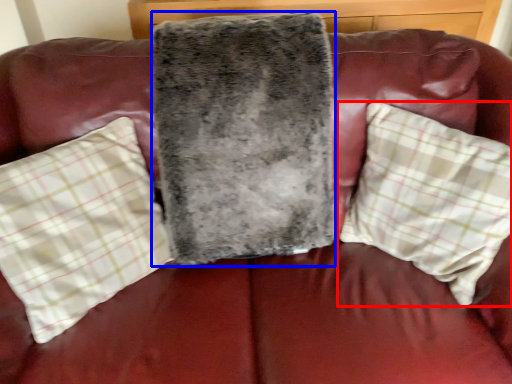
Question: Among these objects, which one is nearest to the camera, pillow (highlighted by a red box) or blanket (highlighted by a blue box)?

Choices:
 (A) pillow
 (B) blanket

Answer: (A)